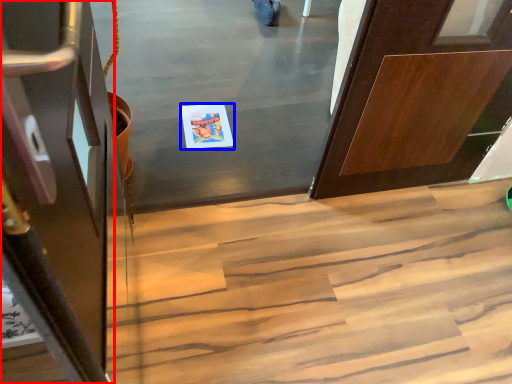
Question: Which of the following is the farthest to the observer, door (highlighted by a red box) or postcard (highlighted by a blue box)?

Choices:
 (A) door
 (B) postcard

Answer: (B)